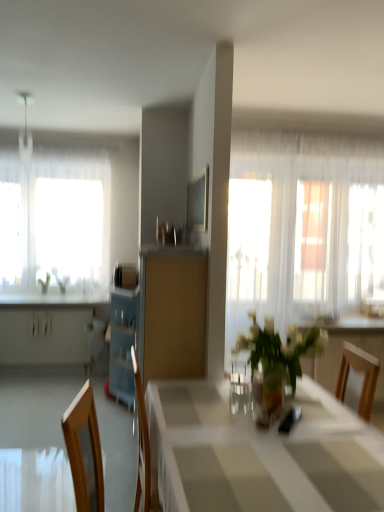
In order to click on free space above white matte radiator at left (from a real-world perspective) in this screenshot , I will do `click(54, 307)`.